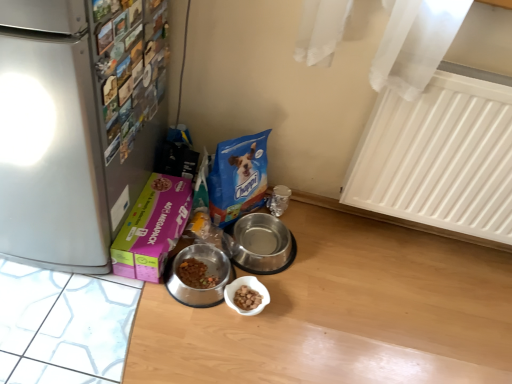
Question: Is white plastic radiator at upper right at the right side of metallic stainless steel bowl at center, arranged as the 2th appliance when viewed from the right?

Choices:
 (A) yes
 (B) no

Answer: (A)

Question: Does white plastic radiator at upper right come in front of metallic stainless steel bowl at center, arranged as the 2th appliance when viewed from the right?

Choices:
 (A) no
 (B) yes

Answer: (B)

Question: From the image's perspective, is white plastic radiator at upper right located above metallic stainless steel bowl at center, arranged as the 2th appliance when viewed from the right?

Choices:
 (A) yes
 (B) no

Answer: (A)

Question: Does white plastic radiator at upper right touch metallic stainless steel bowl at center, arranged as the 2th appliance when viewed from the right?

Choices:
 (A) yes
 (B) no

Answer: (B)

Question: From a real-world perspective, is white plastic radiator at upper right physically above metallic stainless steel bowl at center, arranged as the 2th appliance when viewed from the right?

Choices:
 (A) yes
 (B) no

Answer: (A)

Question: Choose the correct answer: Is metallic stainless steel bowl at center, arranged as the 2th appliance when viewed from the right, inside white plastic radiator at upper right or outside it?

Choices:
 (A) outside
 (B) inside

Answer: (A)

Question: From a real-world perspective, is metallic stainless steel bowl at center, which is the first appliance in left-to-right order, physically located above or below white plastic radiator at upper right?

Choices:
 (A) below
 (B) above

Answer: (A)

Question: From their relative heights in the image, would you say metallic stainless steel bowl at center, arranged as the 2th appliance when viewed from the right, is taller or shorter than white plastic radiator at upper right?

Choices:
 (A) tall
 (B) short

Answer: (B)

Question: In terms of size, does metallic stainless steel bowl at center, which is the first appliance in left-to-right order, appear bigger or smaller than white plastic radiator at upper right?

Choices:
 (A) small
 (B) big

Answer: (A)

Question: Is pink cardboard box at lower left spatially inside silver metallic bowl at center, the 2th appliance from the left, or outside of it?

Choices:
 (A) inside
 (B) outside

Answer: (B)

Question: Considering the positions of point (130, 241) and point (237, 226), is point (130, 241) closer or farther from the camera than point (237, 226)?

Choices:
 (A) farther
 (B) closer

Answer: (B)

Question: Is pink cardboard box at lower left taller or shorter than silver metallic bowl at center, the 2th appliance from the left?

Choices:
 (A) short
 (B) tall

Answer: (B)

Question: From the image's perspective, relative to silver metallic bowl at center, the 2th appliance from the left, is pink cardboard box at lower left above or below?

Choices:
 (A) above
 (B) below

Answer: (A)

Question: From the image's perspective, is white plastic radiator at upper right above or below metallic stainless steel bowl at center, which is the first appliance in left-to-right order?

Choices:
 (A) below
 (B) above

Answer: (B)

Question: From a real-world perspective, is white plastic radiator at upper right positioned above or below metallic stainless steel bowl at center, arranged as the 2th appliance when viewed from the right?

Choices:
 (A) below
 (B) above

Answer: (B)